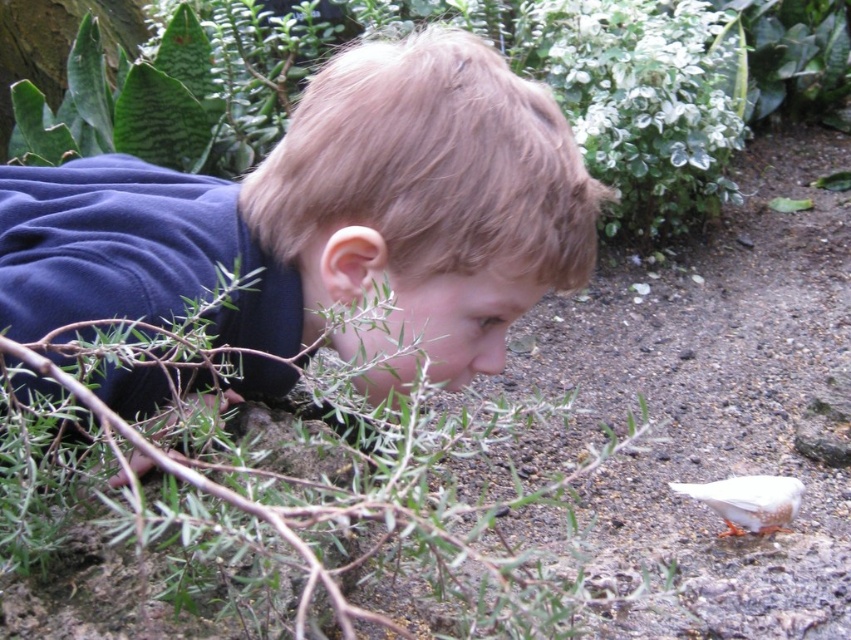
Question: Is green leafy plant at center positioned before white speckled feather at lower right?

Choices:
 (A) yes
 (B) no

Answer: (A)

Question: Can you confirm if dark blue sweatshirt at center is positioned below white speckled feather at lower right?

Choices:
 (A) yes
 (B) no

Answer: (B)

Question: Does green leafy plant at center appear on the left side of white speckled feather at lower right?

Choices:
 (A) no
 (B) yes

Answer: (B)

Question: Which point appears farthest from the camera in this image?

Choices:
 (A) (236, 198)
 (B) (324, 609)

Answer: (A)

Question: Which object appears closest to the camera in this image?

Choices:
 (A) white speckled feather at lower right
 (B) dark blue sweatshirt at center

Answer: (B)

Question: Considering the real-world distances, which object is farthest from the dark blue sweatshirt at center?

Choices:
 (A) green leafy plant at center
 (B) white speckled feather at lower right

Answer: (B)